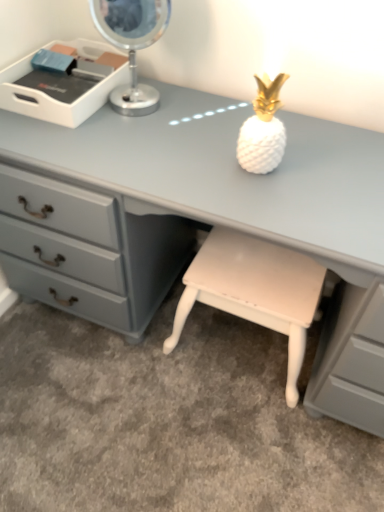
Question: Can you confirm if matte gray desk at center is shorter than metallic silver table lamp at upper left?

Choices:
 (A) yes
 (B) no

Answer: (B)

Question: From the image's perspective, is matte gray desk at center on top of metallic silver table lamp at upper left?

Choices:
 (A) no
 (B) yes

Answer: (A)

Question: Could you tell me if matte gray desk at center is facing metallic silver table lamp at upper left?

Choices:
 (A) yes
 (B) no

Answer: (B)

Question: From a real-world perspective, is matte gray desk at center below metallic silver table lamp at upper left?

Choices:
 (A) yes
 (B) no

Answer: (A)

Question: Is matte gray desk at center positioned before metallic silver table lamp at upper left?

Choices:
 (A) no
 (B) yes

Answer: (B)

Question: Would you consider matte gray desk at center to be distant from metallic silver table lamp at upper left?

Choices:
 (A) no
 (B) yes

Answer: (A)

Question: Can you confirm if metallic silver table lamp at upper left is shorter than matte gray desk at center?

Choices:
 (A) no
 (B) yes

Answer: (B)

Question: Could you tell me if metallic silver table lamp at upper left is turned towards matte gray desk at center?

Choices:
 (A) no
 (B) yes

Answer: (A)

Question: Is metallic silver table lamp at upper left to the left of matte gray desk at center from the viewer's perspective?

Choices:
 (A) yes
 (B) no

Answer: (A)

Question: Is metallic silver table lamp at upper left positioned with its back to matte gray desk at center?

Choices:
 (A) yes
 (B) no

Answer: (B)

Question: Is metallic silver table lamp at upper left to the right of matte gray desk at center from the viewer's perspective?

Choices:
 (A) yes
 (B) no

Answer: (B)

Question: Is metallic silver table lamp at upper left far away from matte gray desk at center?

Choices:
 (A) yes
 (B) no

Answer: (B)

Question: From the image's perspective, does metallic silver table lamp at upper left appear lower than white plastic tray at upper left?

Choices:
 (A) yes
 (B) no

Answer: (B)